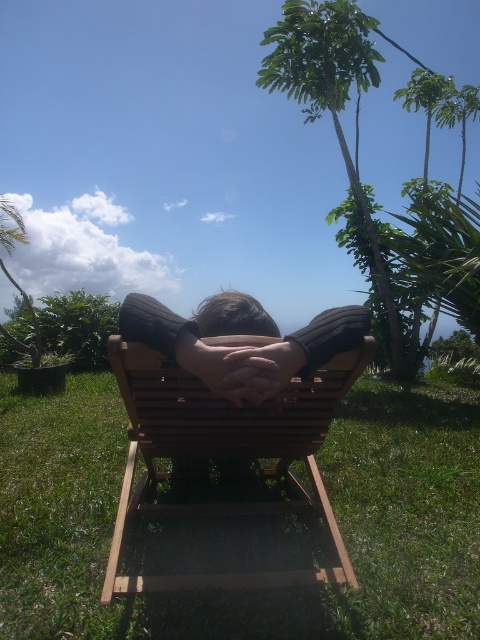
Question: Considering the relative positions of green grass at lower center and green leafy palm tree at upper right in the image provided, where is green grass at lower center located with respect to green leafy palm tree at upper right?

Choices:
 (A) above
 (B) below

Answer: (B)

Question: Among these points, which one is nearest to the camera?

Choices:
 (A) (235, 600)
 (B) (319, 108)
 (C) (190, 328)

Answer: (C)

Question: Among these objects, which one is nearest to the camera?

Choices:
 (A) wooden beach chair at center
 (B) dark brown sweater at center
 (C) green grass at lower center
 (D) green leafy palm tree at upper right

Answer: (B)

Question: Is green grass at lower center thinner than green leafy palm tree at upper right?

Choices:
 (A) yes
 (B) no

Answer: (B)

Question: Can you confirm if green grass at lower center is positioned to the left of wooden beach chair at center?

Choices:
 (A) no
 (B) yes

Answer: (A)

Question: Which point is closer to the camera?

Choices:
 (A) green leafy palm tree at upper right
 (B) green grass at lower center
 (C) wooden beach chair at center

Answer: (C)